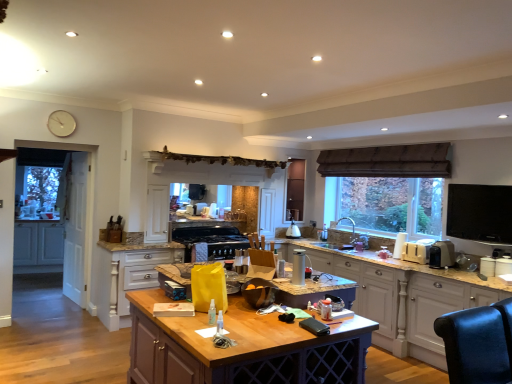
The height and width of the screenshot is (384, 512). What are the coordinates of `free space to the left of black plastic toaster at right, which is the first appliance in right-to-left order` in the screenshot? It's located at (419, 264).